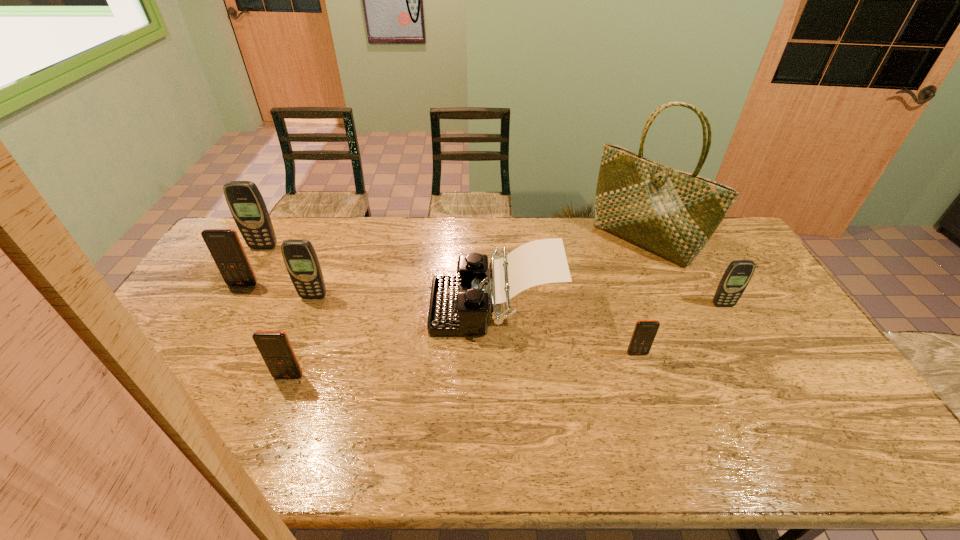
Where is `cellular telephone object that ranks as the closest to the shopping bag`? cellular telephone object that ranks as the closest to the shopping bag is located at coordinates (736, 277).

Identify the location of cellular telephone that can be found as the fifth closest to the fifth object from left to right. (224, 245).

Find the location of a particular element. The width and height of the screenshot is (960, 540). the third closest gray cellular telephone to the tallest object is located at coordinates (247, 206).

At what (x,y) coordinates should I click in order to perform the action: click on gray cellular telephone object that ranks as the third closest to the green shopping bag. Please return your answer as a coordinate pair (x, y). The image size is (960, 540). Looking at the image, I should click on (247, 206).

Locate an element on the screen. the closest orange cellular telephone to the shopping bag is located at coordinates (644, 333).

Select which orange cellular telephone appears as the second closest to the farthest orange cellular telephone. Please provide its 2D coordinates. Your answer should be formatted as a tuple, i.e. [(x, y)], where the tuple contains the x and y coordinates of a point satisfying the conditions above.

[(644, 333)]

Where is `free spot that satisfies the following two spatial constraints: 1. on the keys of the typewriter; 2. on the screen of the nearest orange cellular telephone`? The height and width of the screenshot is (540, 960). free spot that satisfies the following two spatial constraints: 1. on the keys of the typewriter; 2. on the screen of the nearest orange cellular telephone is located at coordinates (497, 376).